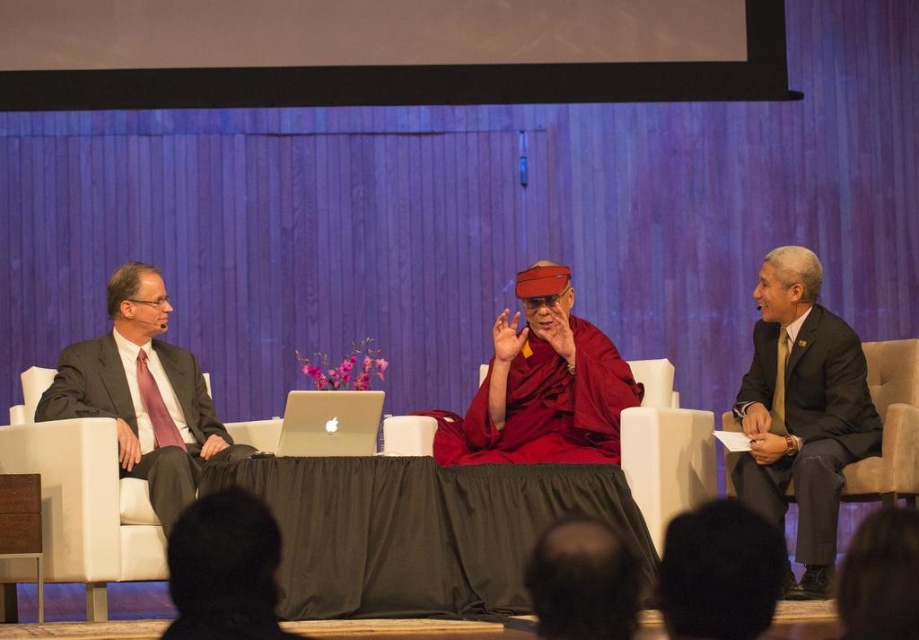
Image resolution: width=919 pixels, height=640 pixels. What are the coordinates of `dark gray suit at left` in the screenshot? It's located at (143, 394).

Can you confirm if dark gray suit at left is smaller than silver metallic laptop at center?

No.

Image resolution: width=919 pixels, height=640 pixels. What do you see at coordinates (143, 394) in the screenshot? I see `dark gray suit at left` at bounding box center [143, 394].

Where is `dark gray suit at left`? This screenshot has width=919, height=640. dark gray suit at left is located at coordinates (143, 394).

Which of these two, dark gray suit at right or silver metallic laptop at center, stands taller?

dark gray suit at right

Is dark gray suit at right bigger than silver metallic laptop at center?

Correct, dark gray suit at right is larger in size than silver metallic laptop at center.

Where is `dark gray suit at right`? The height and width of the screenshot is (640, 919). dark gray suit at right is located at coordinates (801, 412).

At what (x,y) coordinates should I click in order to perform the action: click on black fabric table at center. Please return your answer as a coordinate pair (x, y). The image size is (919, 640). Looking at the image, I should click on (420, 529).

Between black fabric table at center and dark gray suit at right, which one is positioned higher?

dark gray suit at right is above.

Is point (464, 492) positioned behind point (827, 369)?

No.

This screenshot has width=919, height=640. What are the coordinates of `black fabric table at center` in the screenshot? It's located at (420, 529).